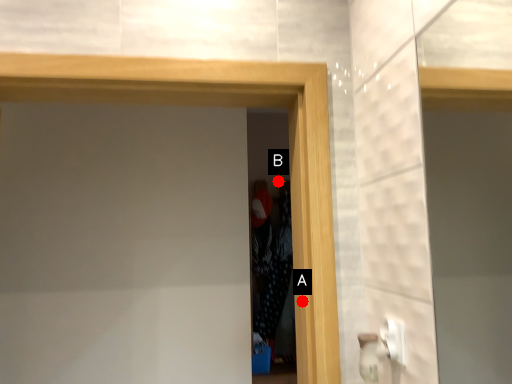
Question: Two points are circled on the image, labeled by A and B beside each circle. Which point is farther to the camera?

Choices:
 (A) A is further
 (B) B is further

Answer: (B)